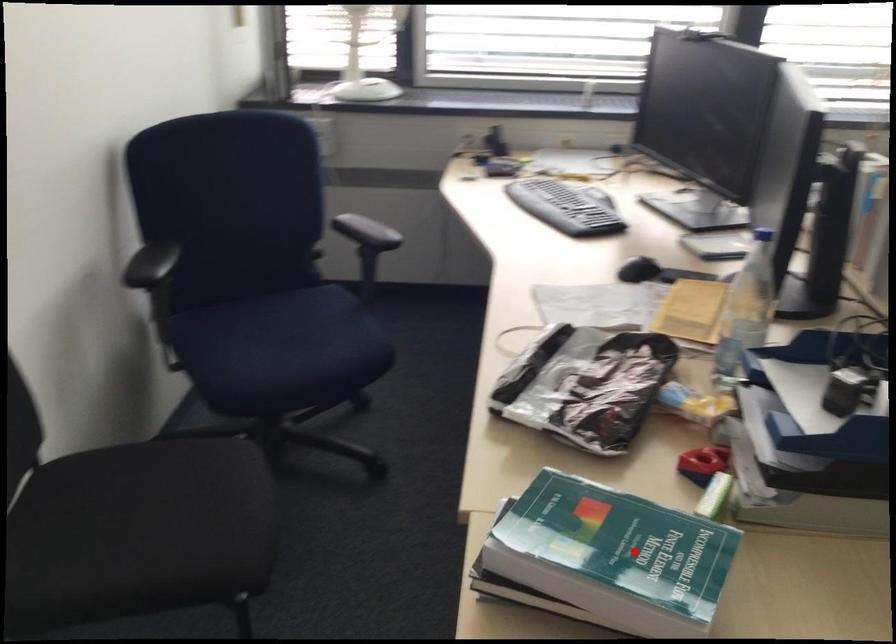
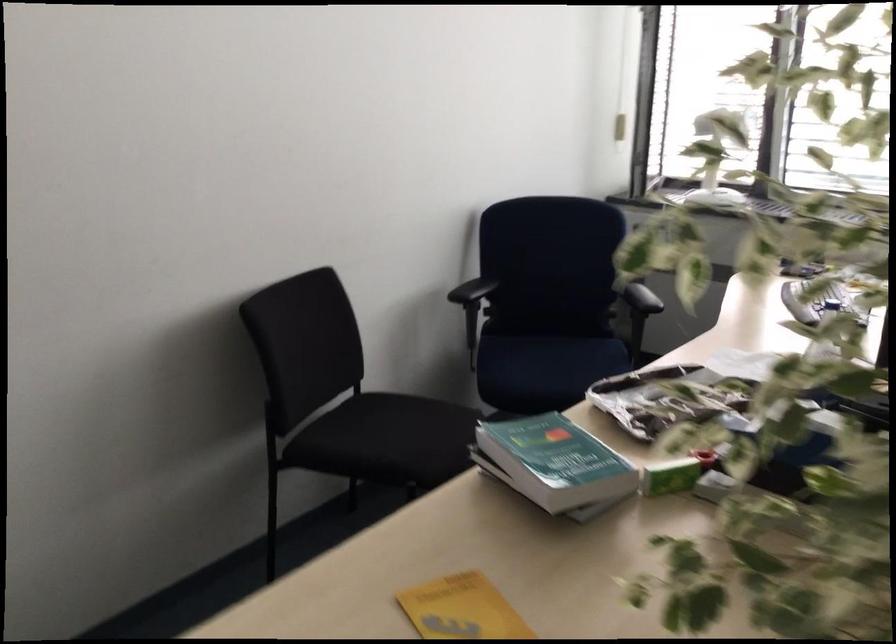
Locate, in the second image, the point that corresponds to the highlighted location in the first image.

(554, 462)